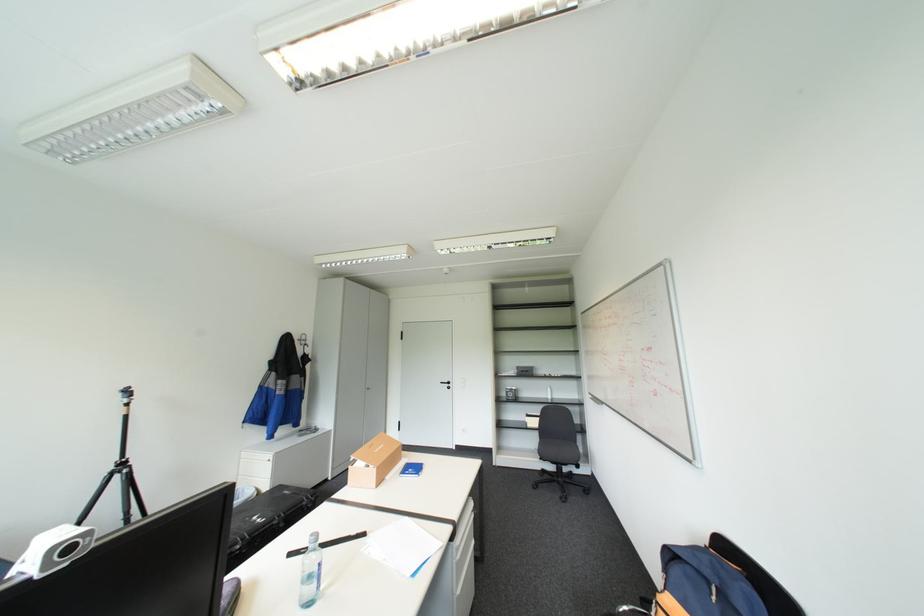
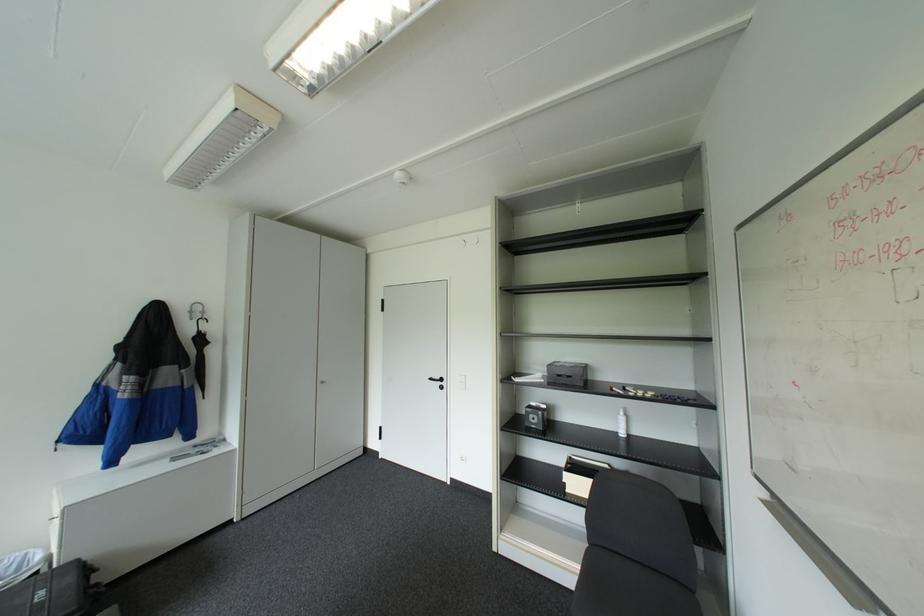
Where in the second image is the point corresponding to (x=310, y=342) from the first image?

(200, 318)